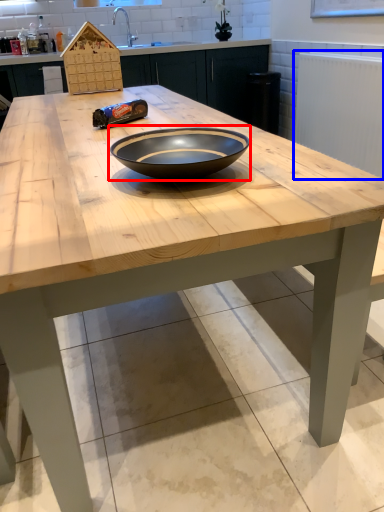
Question: Which of the following is the farthest to the observer, bowl (highlighted by a red box) or radiator (highlighted by a blue box)?

Choices:
 (A) bowl
 (B) radiator

Answer: (B)